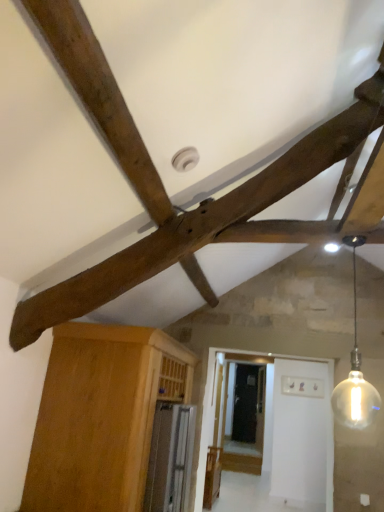
Question: In terms of width, does wooden cabinet at lower left look wider or thinner when compared to translucent glass bulb at upper right?

Choices:
 (A) wide
 (B) thin

Answer: (A)

Question: Considering the positions of wooden cabinet at lower left and translucent glass bulb at upper right in the image, is wooden cabinet at lower left bigger or smaller than translucent glass bulb at upper right?

Choices:
 (A) big
 (B) small

Answer: (A)

Question: Estimate the real-world distances between objects in this image. Which object is farther from the translucent glass bulb at upper right?

Choices:
 (A) wooden cabinet at lower left
 (B) wooden beam at upper center

Answer: (B)

Question: Which of these objects is positioned farthest from the translucent glass bulb at upper right?

Choices:
 (A) wooden cabinet at lower left
 (B) wooden beam at upper center

Answer: (B)